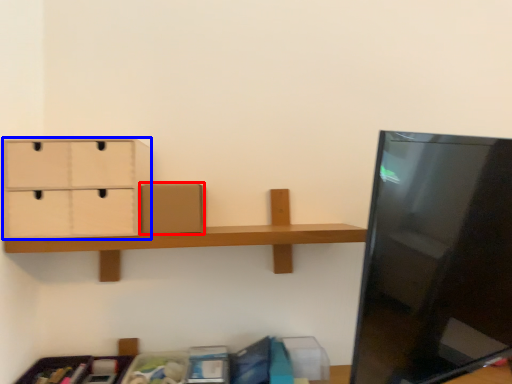
Question: Which of the following is the farthest to the observer, cardboard box (highlighted by a red box) or drawer (highlighted by a blue box)?

Choices:
 (A) cardboard box
 (B) drawer

Answer: (A)